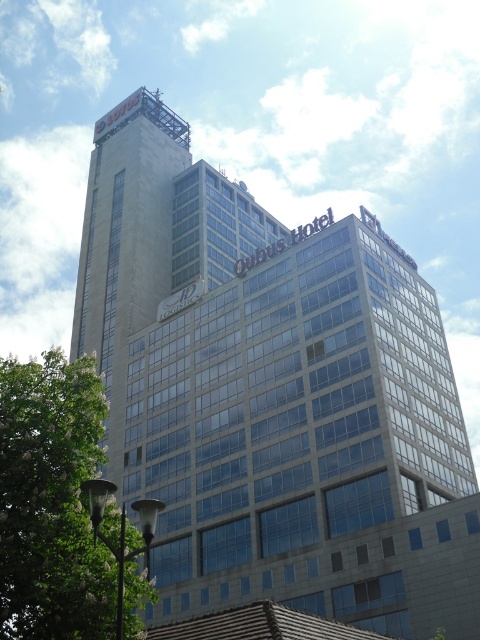
Question: Which of these objects is positioned farthest from the green leafy tree at lower left?

Choices:
 (A) gray concrete building at center
 (B) silver metallic lamp post at lower left

Answer: (A)

Question: Can you confirm if green leafy tree at lower left is positioned above silver metallic lamp post at lower left?

Choices:
 (A) no
 (B) yes

Answer: (B)

Question: Which object is closer to the camera taking this photo?

Choices:
 (A) gray concrete building at center
 (B) green leafy tree at lower left
 (C) silver metallic lamp post at lower left

Answer: (C)

Question: Is gray concrete building at center positioned behind silver metallic lamp post at lower left?

Choices:
 (A) no
 (B) yes

Answer: (B)

Question: Which point is closer to the camera taking this photo?

Choices:
 (A) click(x=119, y=572)
 (B) click(x=222, y=352)

Answer: (A)

Question: Can you confirm if green leafy tree at lower left is positioned above silver metallic lamp post at lower left?

Choices:
 (A) no
 (B) yes

Answer: (B)